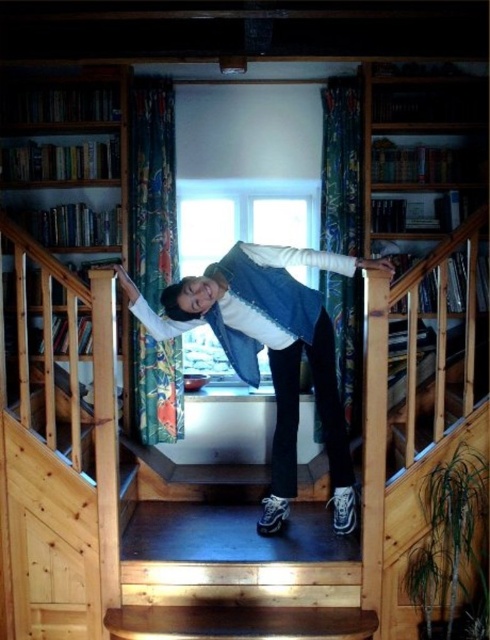
Describe the element at coordinates (269, 352) in the screenshot. This screenshot has width=490, height=640. I see `denim vest at center` at that location.

Can you confirm if denim vest at center is thinner than wooden bookshelf at left?

Incorrect, denim vest at center's width is not less than wooden bookshelf at left's.

Find the location of `denim vest at center`. denim vest at center is located at coordinates (269, 352).

This screenshot has width=490, height=640. What are the coordinates of `denim vest at center` in the screenshot? It's located at (269, 352).

Which of these two, denim vest at center or wooden bookshelf at right, stands shorter?

denim vest at center is shorter.

Is denim vest at center in front of wooden bookshelf at right?

That is True.

Between point (295, 456) and point (397, 257), which one is positioned in front?

Point (295, 456)

The width and height of the screenshot is (490, 640). Identify the location of denim vest at center. (269, 352).

Describe the element at coordinates (439, 332) in the screenshot. I see `wooden bookshelf at right` at that location.

Is point (472, 348) farther from camera compared to point (46, 145)?

No.

Where is `wooden bookshelf at right`? The width and height of the screenshot is (490, 640). wooden bookshelf at right is located at coordinates (439, 332).